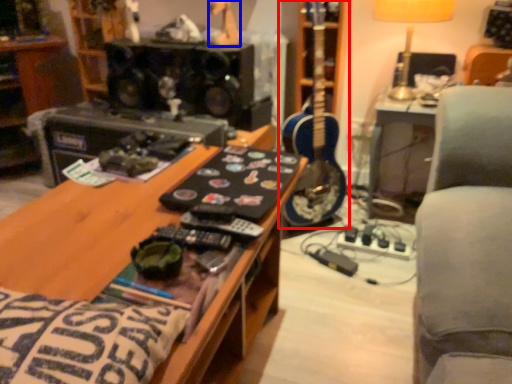
Question: Which object is closer to the camera taking this photo, guitar (highlighted by a red box) or toy (highlighted by a blue box)?

Choices:
 (A) guitar
 (B) toy

Answer: (B)